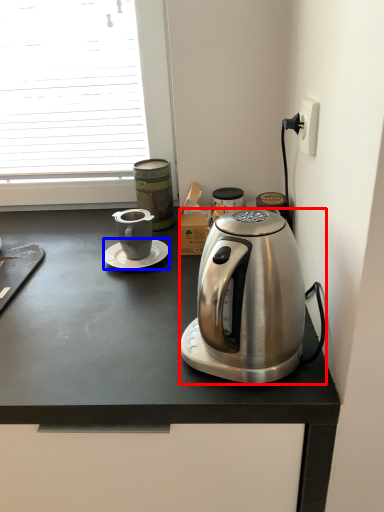
Question: Among these objects, which one is farthest to the camera, coffee maker (highlighted by a red box) or saucer (highlighted by a blue box)?

Choices:
 (A) coffee maker
 (B) saucer

Answer: (B)